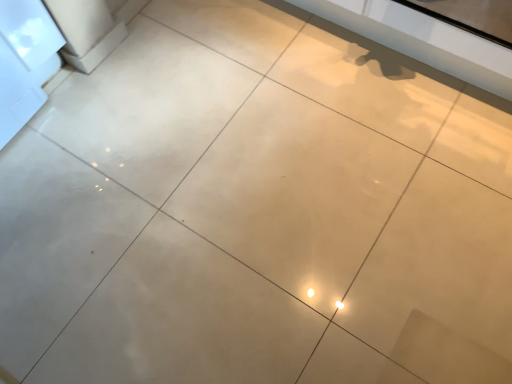
This screenshot has height=384, width=512. What are the coordinates of `white glossy door at upper left` in the screenshot? It's located at (24, 61).

Describe the element at coordinates (24, 61) in the screenshot. I see `white glossy door at upper left` at that location.

You are a GUI agent. You are given a task and a screenshot of the screen. Output one action in this format:
    pyautogui.click(x=<x>, y=<y>)
    Task: Click on the white glossy door at upper left
    
    Given the screenshot: What is the action you would take?
    pyautogui.click(x=24, y=61)